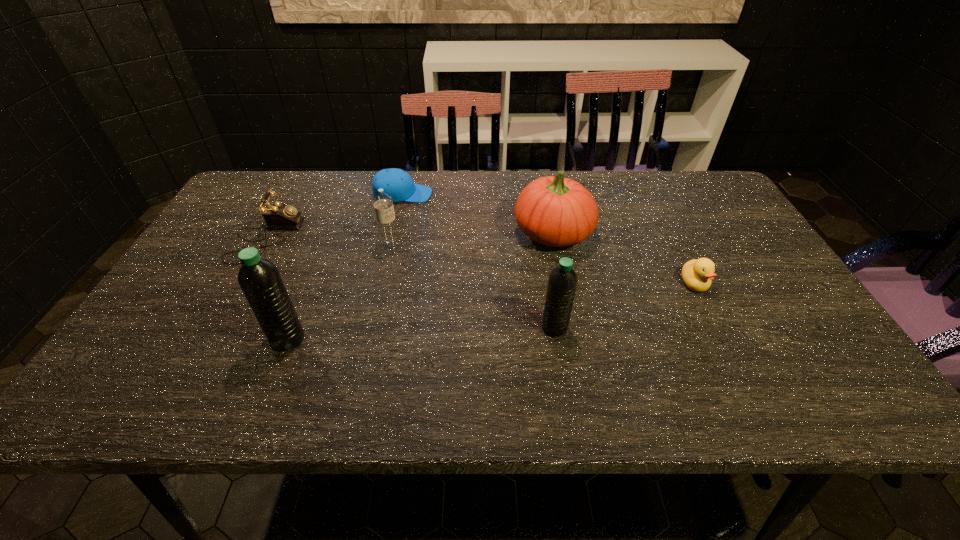
You are a GUI agent. You are given a task and a screenshot of the screen. Output one action in this format:
    pyautogui.click(x=<x>, y=<y>)
    Task: Click on the vacant space located 0.240m on the back of the rightmost water bottle
    
    Given the screenshot: What is the action you would take?
    pyautogui.click(x=542, y=250)

Identify the location of free space located 0.190m on the back of the second water bottle from left to right. (401, 202).

Where is `vacant space located on the front of the pumpkin`? vacant space located on the front of the pumpkin is located at coordinates (577, 360).

Where is `vacant space situated on the front-facing side of the farthest object`? vacant space situated on the front-facing side of the farthest object is located at coordinates (540, 194).

Where is `vacant space located on the dial of the telephone`? vacant space located on the dial of the telephone is located at coordinates (318, 238).

Where is `vacant space located on the face of the fifth farthest object`? vacant space located on the face of the fifth farthest object is located at coordinates (730, 354).

Identify the location of pumpkin at the far edge. (555, 211).

Where is `cap that is at the far edge`? cap that is at the far edge is located at coordinates (397, 183).

In order to click on object present at the left edge in this screenshot , I will do `click(277, 216)`.

Where is `free space at the far edge of the desktop`? The height and width of the screenshot is (540, 960). free space at the far edge of the desktop is located at coordinates (484, 179).